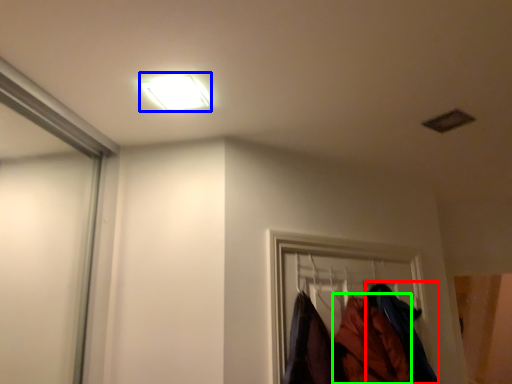
Question: Which is farther away from clothing (highlighted by a red box)? lamp (highlighted by a blue box) or clothing (highlighted by a green box)?

Choices:
 (A) lamp
 (B) clothing

Answer: (A)